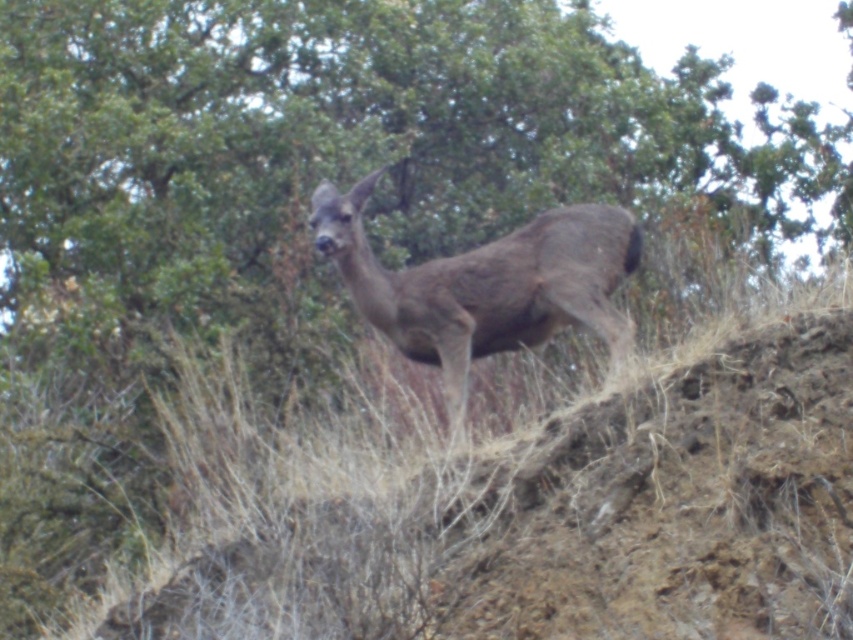
Question: Is green leafy tree at upper center wider than brown fur deer at center?

Choices:
 (A) no
 (B) yes

Answer: (B)

Question: Is the position of green leafy tree at upper center less distant than that of brown fur deer at center?

Choices:
 (A) yes
 (B) no

Answer: (B)

Question: Is green leafy tree at upper center further to camera compared to brown fur deer at center?

Choices:
 (A) no
 (B) yes

Answer: (B)

Question: Which point is farther to the camera?

Choices:
 (A) green leafy tree at upper center
 (B) brown fur deer at center

Answer: (A)

Question: Which of the following is the farthest from the observer?

Choices:
 (A) (294, 148)
 (B) (373, 305)

Answer: (A)